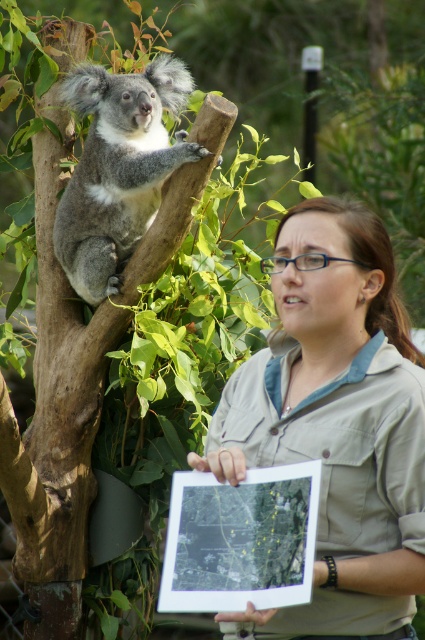
You are standing in front of the scene and want to take a photo of the two points mentioned. Which point, point [323,524] or point [79,176], is closer to your camera?

Point [323,524] is closer to the camera than point [79,176].

You are an animal keeper at the zoo and need to decide which object is thinner between the matte khaki shirt at center and the gray furry koala at upper left. Which one is thinner?

The matte khaki shirt at center is thinner than the gray furry koala at upper left.

You are a zookeeper standing at the center of the enclosure. You need to locate the gray furry koala at upper left. Where should you look relative to your position?

The gray furry koala at upper left is located at point 0.264 on the x coordinate and 0.278 on the y coordinate, so you should look to the upper left direction from your current position.